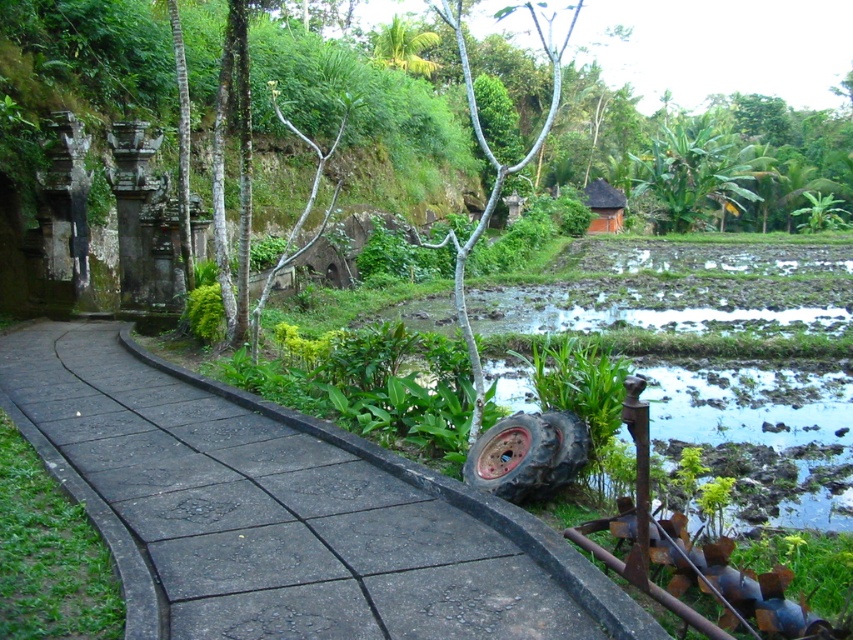
Question: Which point is closer to the camera taking this photo?

Choices:
 (A) (601, 202)
 (B) (544, 486)

Answer: (B)

Question: Does black rubber tire at lower right appear on the right side of brown clay hut at upper center?

Choices:
 (A) no
 (B) yes

Answer: (A)

Question: Does black rubber tire at lower right appear under brown clay hut at upper center?

Choices:
 (A) no
 (B) yes

Answer: (B)

Question: Does black concrete pavement at center appear over black rubber tire at lower right?

Choices:
 (A) no
 (B) yes

Answer: (A)

Question: Which point is closer to the camera taking this photo?

Choices:
 (A) (560, 465)
 (B) (206, 416)
 (C) (602, 202)

Answer: (A)

Question: Which point is farther from the camera taking this photo?

Choices:
 (A) (294, 451)
 (B) (608, 182)

Answer: (B)